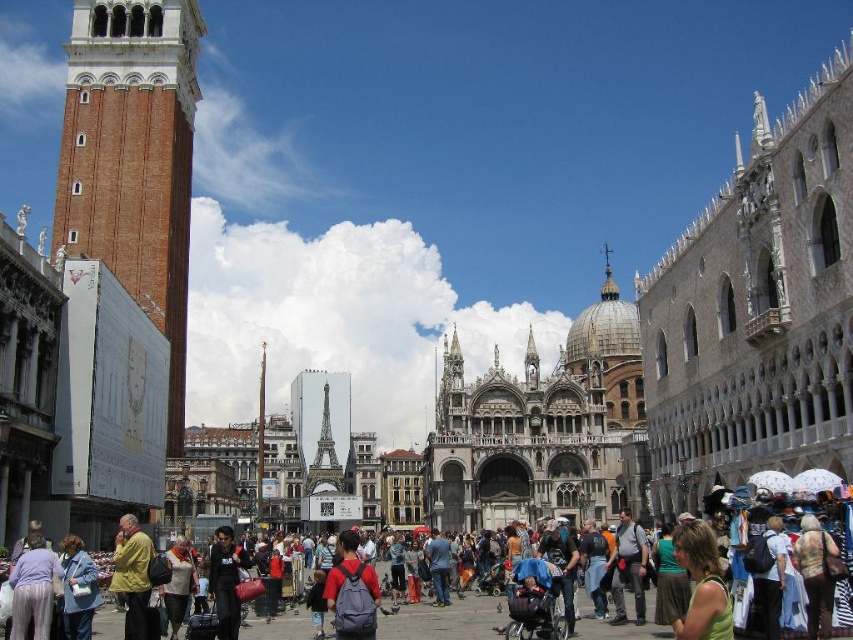
You are standing in St. Mark Square and want to take a photo of the Basilica di San Marco. You notice two points marked in the scene, one at coordinates point [56,248] and another at point [167,560]. Which point should you stand closer to in order to have the Basilica di San Marco fill more of your camera frame?

You should stand closer to point [56,248] because it is closer to the Basilica di San Marco than point [167,560], allowing the Basilica to fill more of your camera frame.

You are standing in St. Mark Square and want to take a photo of the brick tower at left. Where should you position yourself to ensure it fits in the frame?

The brick tower at left is located at the coordinates 0.250 on the x axis and 0.157 on the y axis, so you should position yourself to the left side of the square to capture it in your photo.